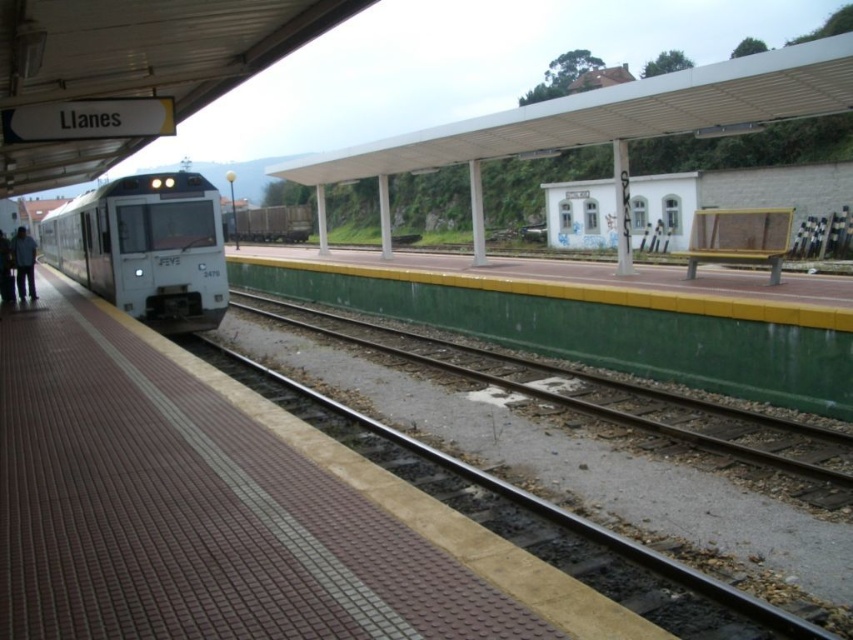
You are a passenger waiting on the Llanes platform. You see the white glossy train at left and the dark gray jacket at left. Which object is larger in size?

The white glossy train at left is bigger than the dark gray jacket at left.

You are standing at the Llanes train station platform. You see the white glossy train at left. If you want to take a photo of it from where you are standing, will you need to zoom in or zoom out your camera?

The white glossy train at left is 14.19 meters away from the camera. Since it is relatively far away, you will need to zoom in your camera to capture a clear image of the train.

You are a passenger waiting on the platform at Llanes station. You see the green concrete train track at center and the white glossy train at left. Which object is larger in size?

The white glossy train at left is larger than the green concrete train track at center.